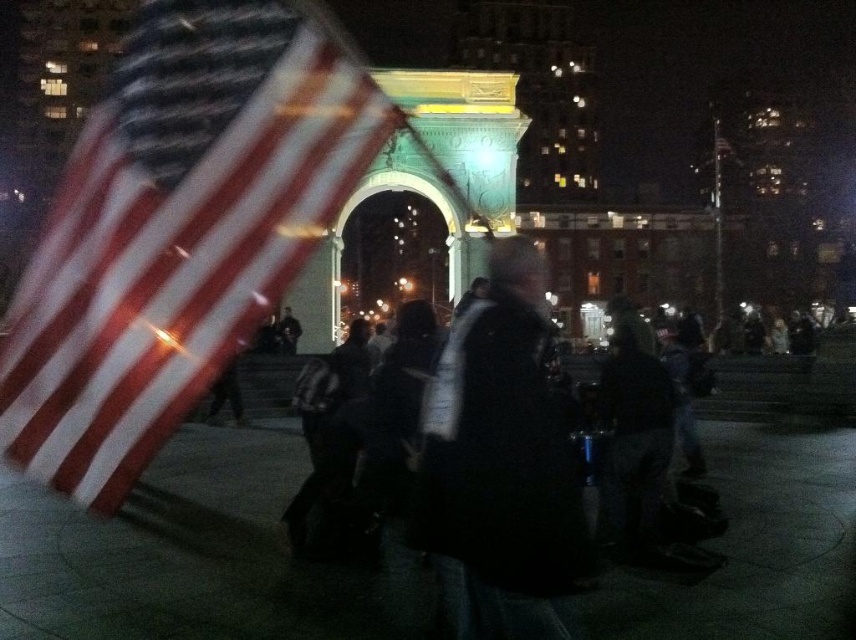
Is dark gray jacket at center thinner than black matte jacket at center?

No.

Is dark gray jacket at center below black matte jacket at center?

Correct, dark gray jacket at center is located below black matte jacket at center.

Which is in front, point (473, 433) or point (535, 285)?

Point (473, 433)

At what (x,y) coordinates should I click in order to perform the action: click on dark gray jacket at center. Please return your answer as a coordinate pair (x, y). This screenshot has height=640, width=856. Looking at the image, I should click on (502, 467).

Is matte fabric flag at left below dark gray jacket at center?

No, matte fabric flag at left is not below dark gray jacket at center.

You are a GUI agent. You are given a task and a screenshot of the screen. Output one action in this format:
    pyautogui.click(x=<x>, y=<y>)
    Task: Click on the matte fabric flag at left
    The height and width of the screenshot is (640, 856).
    Given the screenshot: What is the action you would take?
    pyautogui.click(x=176, y=230)

Who is positioned more to the right, matte fabric flag at left or black matte jacket at center?

Positioned to the right is black matte jacket at center.

Does point (189, 362) come closer to viewer compared to point (513, 385)?

No, it is behind (513, 385).

I want to click on matte fabric flag at left, so click(x=176, y=230).